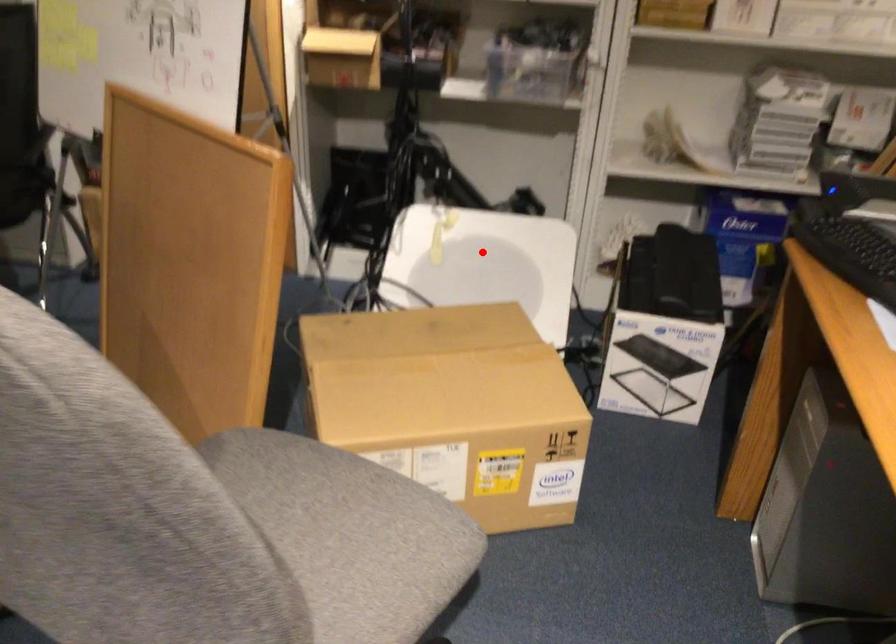
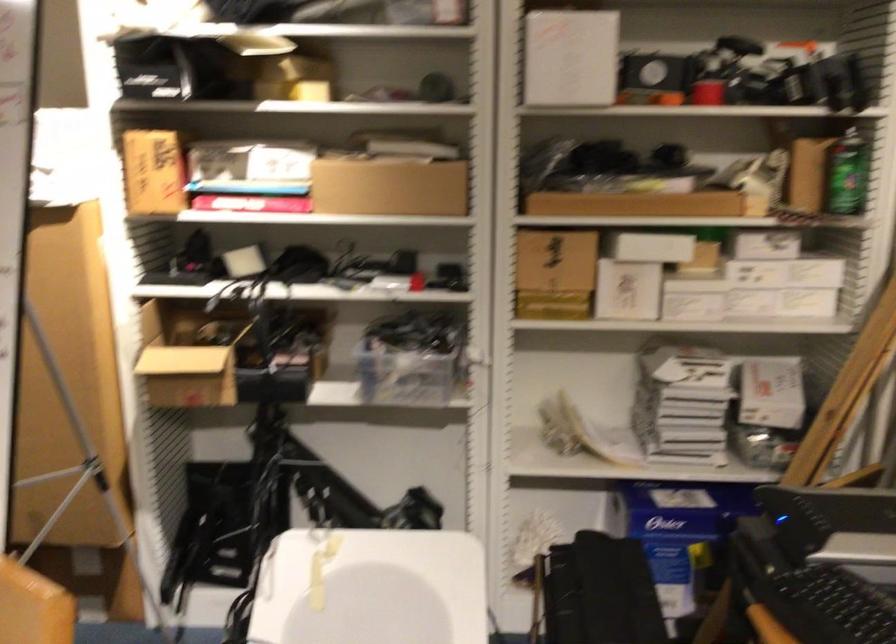
Question: A red point is marked in image1. In image2, is the corresponding 3D point closer to the camera or farther? Reply with the corresponding letter.

Choices:
 (A) The corresponding 3D point is closer.
 (B) The corresponding 3D point is farther.

Answer: (A)